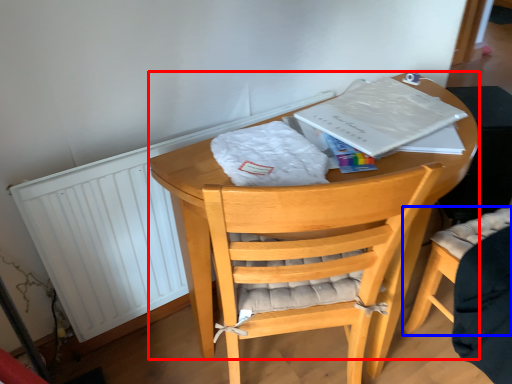
Question: Which object is closer to the camera taking this photo, round table (highlighted by a red box) or chair (highlighted by a blue box)?

Choices:
 (A) round table
 (B) chair

Answer: (A)